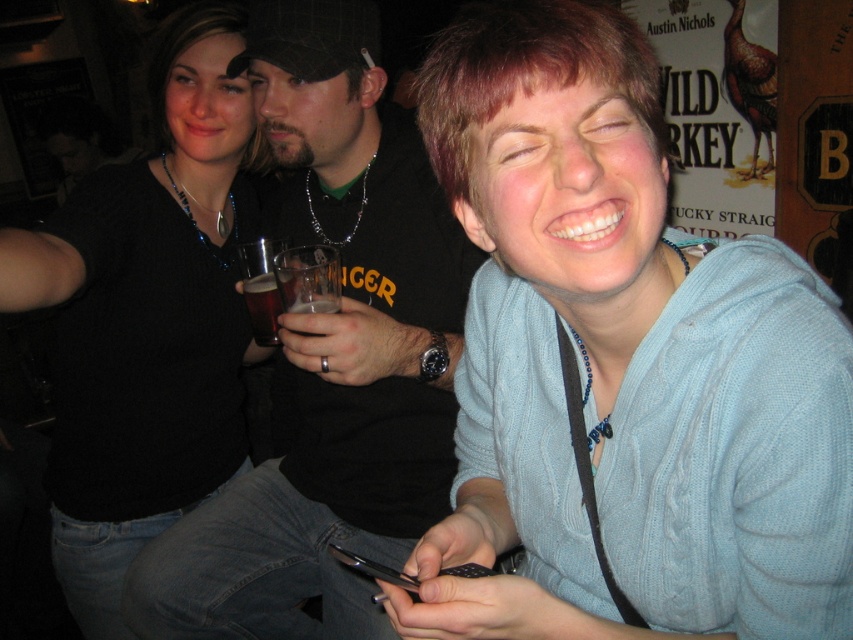
Between cable-knit sweater at center and black shirt at center, which one has less height?

cable-knit sweater at center

Does cable-knit sweater at center have a larger size compared to black shirt at center?

Actually, cable-knit sweater at center might be smaller than black shirt at center.

Where is `cable-knit sweater at center`? The width and height of the screenshot is (853, 640). cable-knit sweater at center is located at coordinates click(622, 364).

This screenshot has height=640, width=853. I want to click on cable-knit sweater at center, so click(622, 364).

Is black shirt at center to the right of black matte sweater at upper left from the viewer's perspective?

Yes, black shirt at center is to the right of black matte sweater at upper left.

Is point (352, 58) farther from camera compared to point (126, 502)?

That is False.

Locate an element on the screen. Image resolution: width=853 pixels, height=640 pixels. black shirt at center is located at coordinates (331, 356).

Does black shirt at center appear on the left side of brown translucent glass at center?

No, black shirt at center is not to the left of brown translucent glass at center.

Is black shirt at center below brown translucent glass at center?

Yes.

Does point (412, 449) come farther from viewer compared to point (244, 285)?

Yes, point (412, 449) is farther from viewer.

Where is `black shirt at center`? black shirt at center is located at coordinates (331, 356).